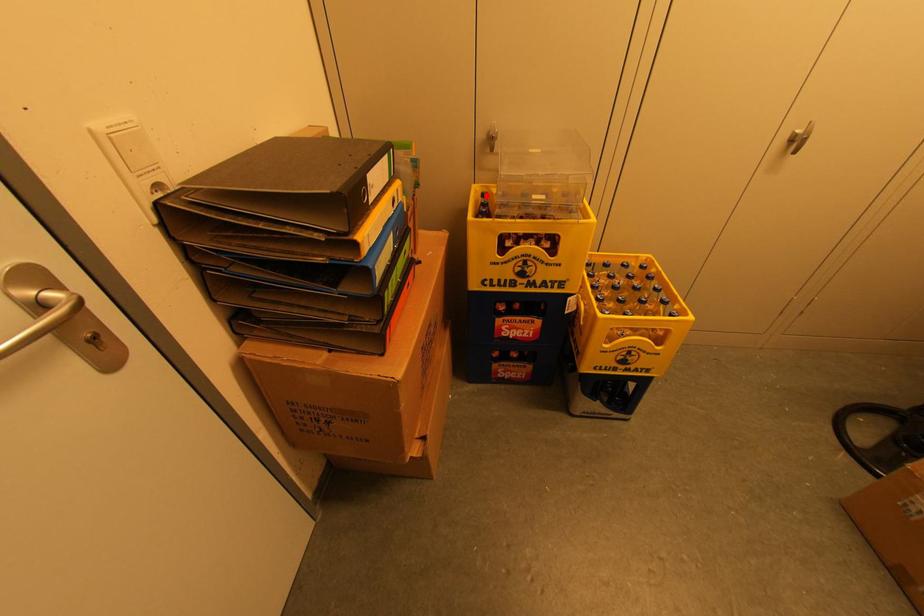
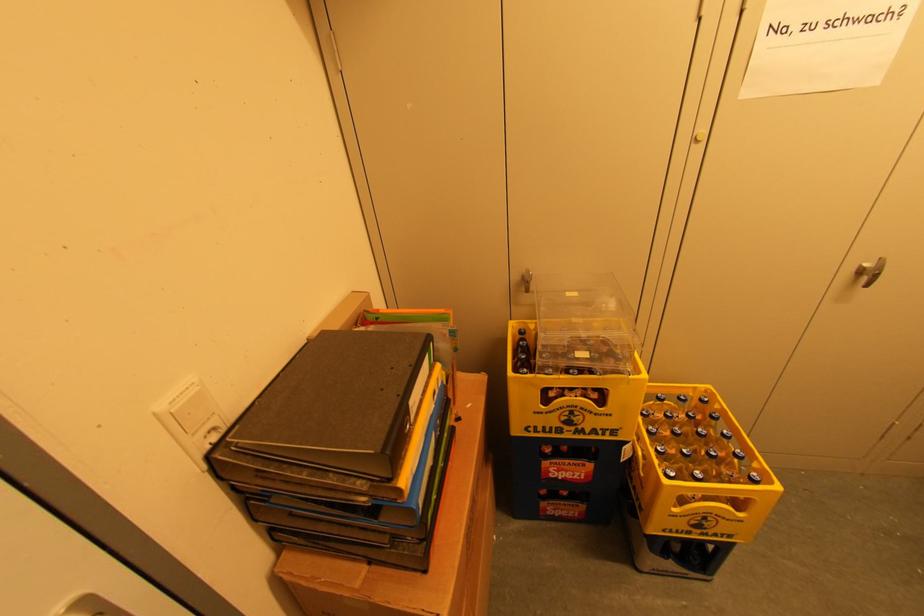
In the second image, find the point that corresponds to the highlighted location in the first image.

(525, 333)